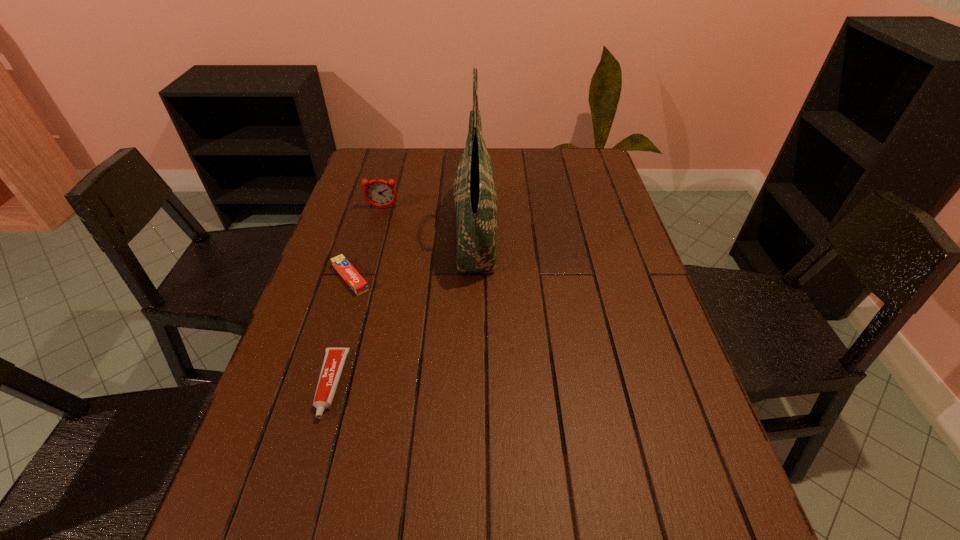
You are a GUI agent. You are given a task and a screenshot of the screen. Output one action in this format:
    pyautogui.click(x=<x>, y=<y>)
    Task: Click on the vacant position in the image that satisfies the following two spatial constraints: 1. on the front-facing side of the tallest object; 2. on the right side of the alarm clock
    The height and width of the screenshot is (540, 960).
    Given the screenshot: What is the action you would take?
    tap(375, 233)